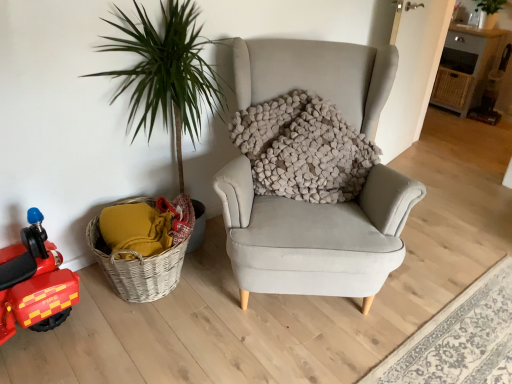
In order to click on free space to the right of shiny red plastic toy car at left in this screenshot , I will do `click(93, 333)`.